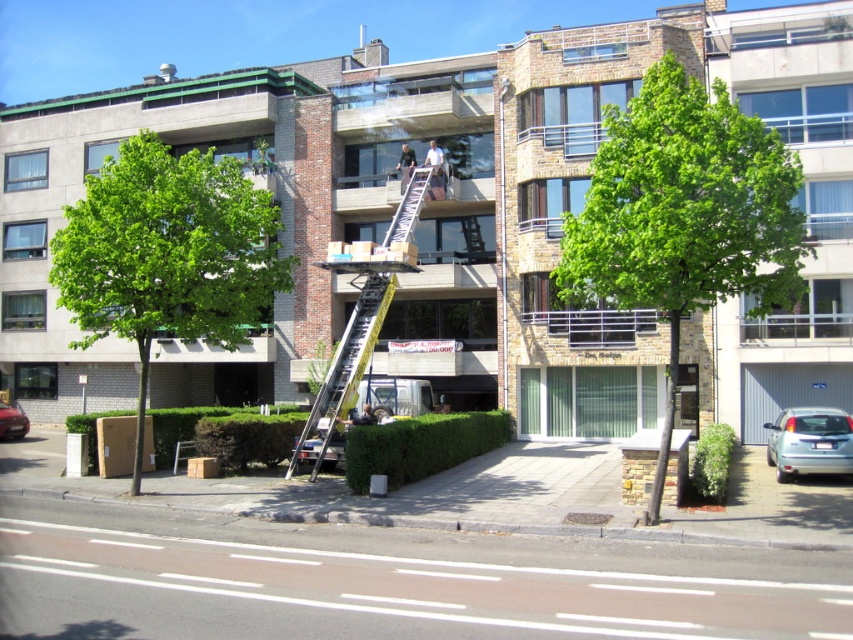
Question: Can you confirm if light blue shirt at center is positioned to the left of light brown leather jacket at lower center?

Choices:
 (A) no
 (B) yes

Answer: (A)

Question: Is silver metallic ladder at center thinner than light brown leather jacket at lower center?

Choices:
 (A) yes
 (B) no

Answer: (B)

Question: Which of these objects is positioned closest to the light blue shirt at center?

Choices:
 (A) shiny red car at lower left
 (B) green leafy tree at center
 (C) silver metallic sedan at lower right
 (D) silver metallic ladder at center

Answer: (D)

Question: Which point is farther to the camera?

Choices:
 (A) (413, 152)
 (B) (323, 394)
 (C) (431, 150)

Answer: (A)

Question: Which of the following is the closest to the observer?

Choices:
 (A) (100, 301)
 (B) (364, 412)

Answer: (A)

Question: Considering the relative positions of green leafy tree at left and silver metallic ladder at center in the image provided, where is green leafy tree at left located with respect to silver metallic ladder at center?

Choices:
 (A) below
 (B) above

Answer: (B)